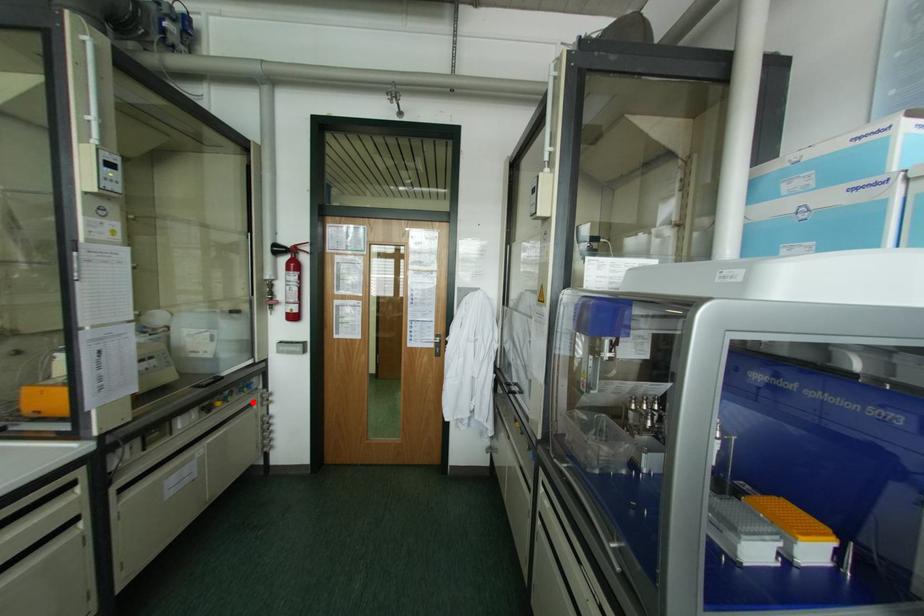
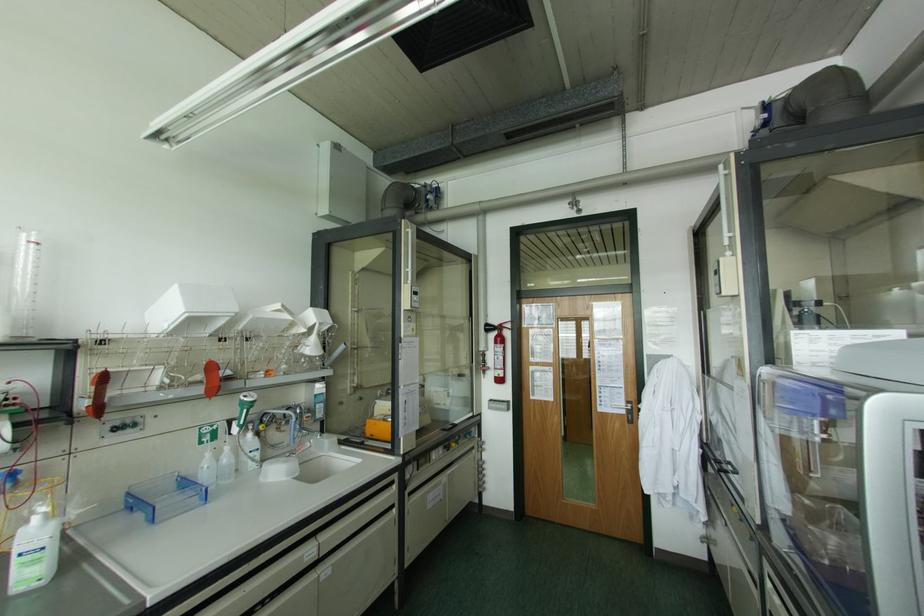
The point at the highlighted location is marked in the first image. Where is the corresponding point in the second image?

(472, 448)